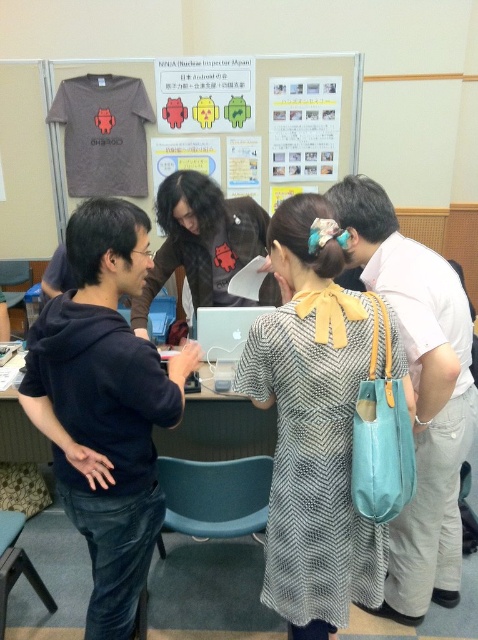
Who is positioned more to the left, patterned fabric dress at center or black hoodie at left?

black hoodie at left is more to the left.

Is point (307, 500) more distant than point (152, 468)?

No, it is not.

Locate an element on the screen. patterned fabric dress at center is located at coordinates (316, 422).

Who is lower down, black hoodie at left or light blue fabric bag at right?

Positioned lower is light blue fabric bag at right.

Is black hoodie at left to the left of light blue fabric bag at right from the viewer's perspective?

Indeed, black hoodie at left is positioned on the left side of light blue fabric bag at right.

Image resolution: width=478 pixels, height=640 pixels. In order to click on black hoodie at left in this screenshot , I will do `click(105, 406)`.

Where is `black hoodie at left`? The height and width of the screenshot is (640, 478). black hoodie at left is located at coordinates (105, 406).

Which is in front, point (258, 246) or point (282, 161)?

Positioned in front is point (258, 246).

Can you confirm if matte black shirt at center is wider than white paper at upper center?

Yes.

Identify the location of matte black shirt at center. (204, 244).

Find the location of a particular element. matte black shirt at center is located at coordinates pyautogui.click(x=204, y=244).